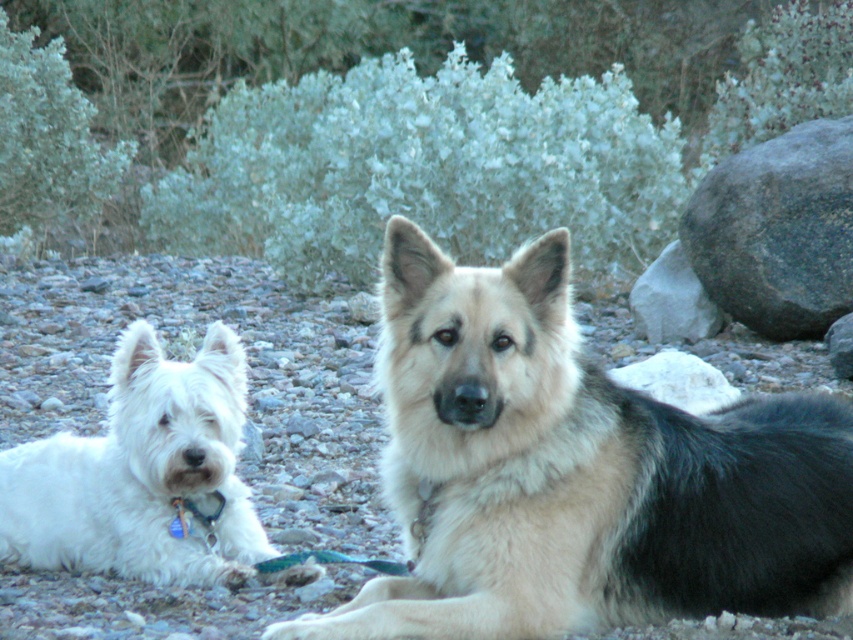
You are standing at the camera position and want to throw a ball to the white fluffy dog at left. If the ball travels in a straight line, how far will it have to go to reach the dog?

The ball will have to travel 15.12 feet to reach the white fluffy dog at left since that is the distance between them.

You are a photographer setting up a tripod to take a portrait of the white fluffy dog at left and the gray rock at right. Based on the scene, which object is taller so that it can be framed properly?

The white fluffy dog at left is taller than the gray rock at right, so it should be framed to account for its height.